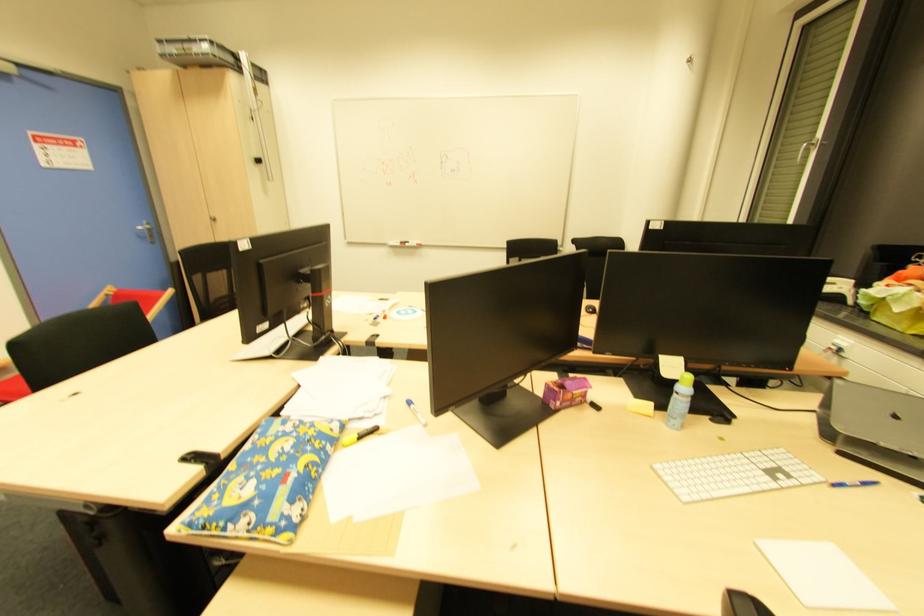
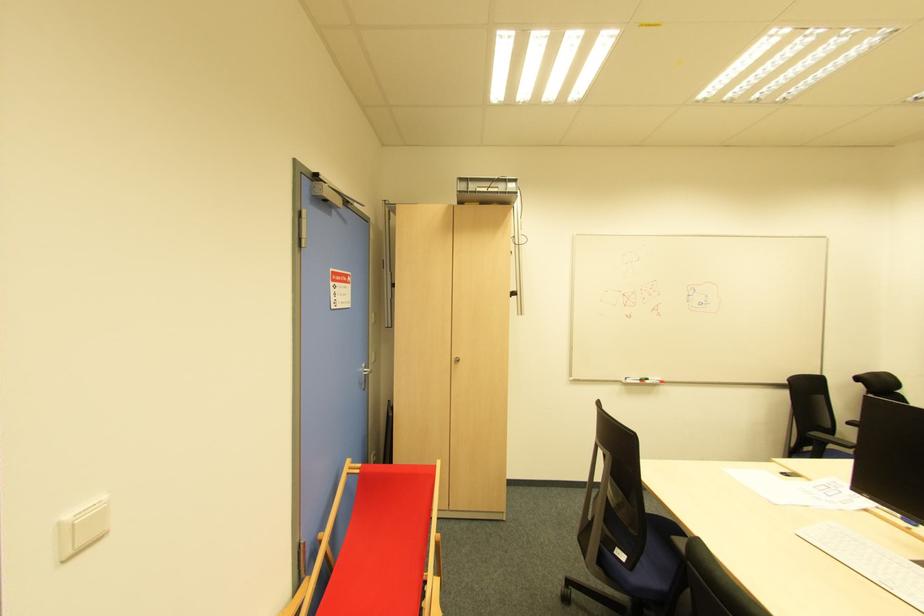
The point at (407, 246) is marked in the first image. Where is the corresponding point in the second image?

(647, 383)